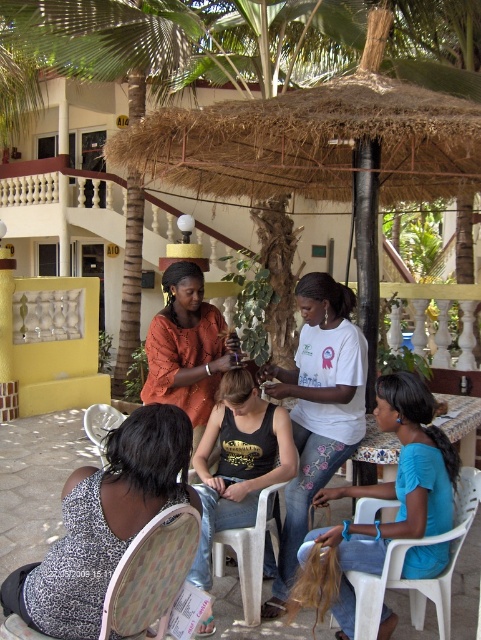
Question: Where is black tank top at center located in relation to matte orange blouse at center in the image?

Choices:
 (A) below
 (B) above

Answer: (A)

Question: Considering the real-world distances, which object is closest to the matte orange blouse at center?

Choices:
 (A) blue fabric hair at lower right
 (B) white cotton shirt at center

Answer: (B)

Question: Is blue fabric hair at lower right closer to camera compared to white plastic chair at lower right?

Choices:
 (A) yes
 (B) no

Answer: (A)

Question: Does white cotton shirt at center appear on the right side of white plastic chair at lower right?

Choices:
 (A) no
 (B) yes

Answer: (A)

Question: Which point is closer to the camera?

Choices:
 (A) white plastic chair at lower center
 (B) blue fabric hair at lower right

Answer: (B)

Question: Which of these objects is positioned farthest from the marble-patterned table at center?

Choices:
 (A) white plastic chair at lower left
 (B) white plastic chair at lower right
 (C) white cotton shirt at center

Answer: (A)